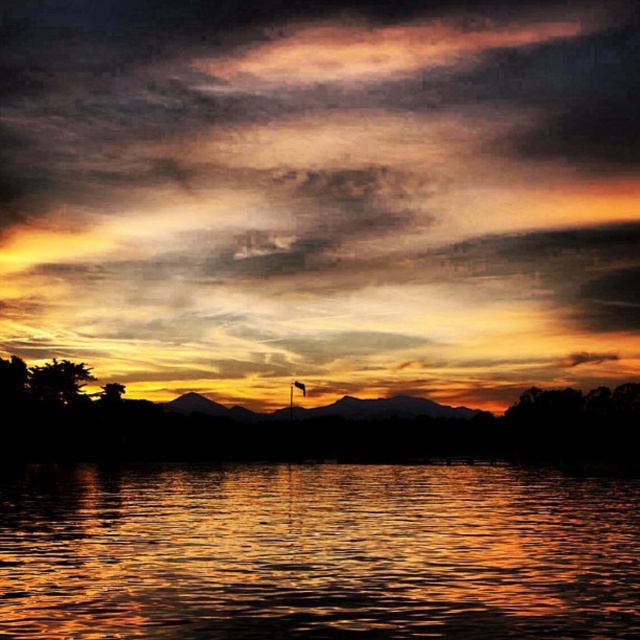
Question: Which point is closer to the camera?

Choices:
 (A) (499, 214)
 (B) (234, 580)

Answer: (B)

Question: Does matte orange sky at center lie in front of shiny reflective water at center?

Choices:
 (A) yes
 (B) no

Answer: (B)

Question: Considering the relative positions of matte orange sky at center and shiny reflective water at center in the image provided, where is matte orange sky at center located with respect to shiny reflective water at center?

Choices:
 (A) left
 (B) right

Answer: (A)

Question: Is matte orange sky at center bigger than shiny reflective water at center?

Choices:
 (A) yes
 (B) no

Answer: (A)